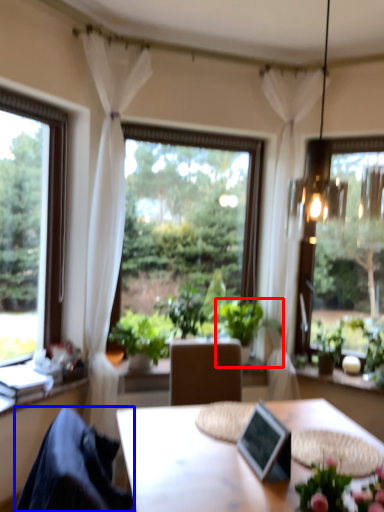
Question: Which of the following is the farthest to the observer, houseplant (highlighted by a red box) or chair (highlighted by a blue box)?

Choices:
 (A) houseplant
 (B) chair

Answer: (A)